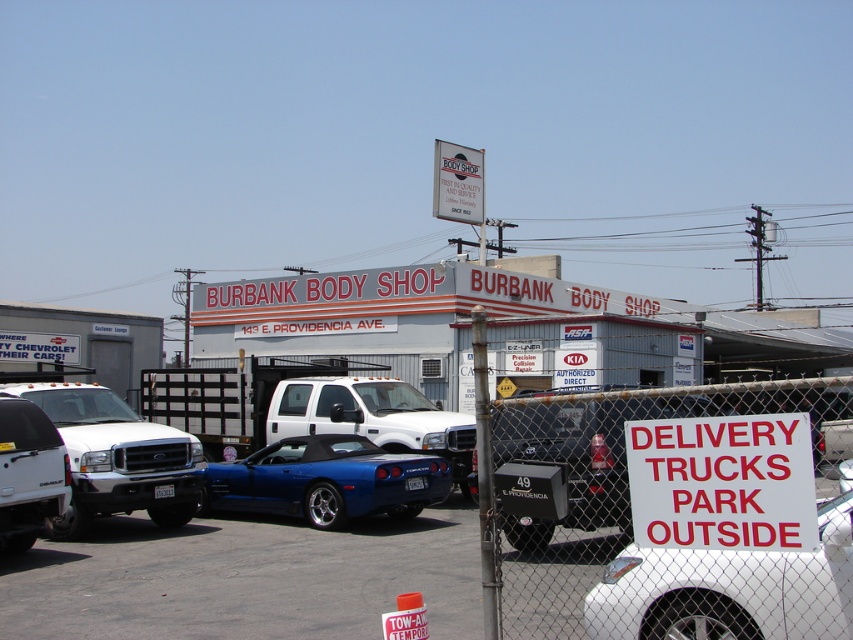
Question: Does white plastic sign at lower right have a larger size compared to matte white truck at left?

Choices:
 (A) no
 (B) yes

Answer: (A)

Question: Is white glossy truck at left bigger than white plastic sign at lower right?

Choices:
 (A) no
 (B) yes

Answer: (A)

Question: Which object appears farthest from the camera in this image?

Choices:
 (A) white glossy truck at left
 (B) white plastic sign at upper center
 (C) white glossy car at lower right

Answer: (B)

Question: Which is nearer to the white glossy car at lower right?

Choices:
 (A) white plastic sign at lower right
 (B) glossy blue convertible at center
 (C) white glossy truck at left
 (D) white matte truck at left

Answer: (A)

Question: Is metal chain-link fence at lower right positioned before white glossy car at lower right?

Choices:
 (A) no
 (B) yes

Answer: (B)

Question: Estimate the real-world distances between objects in this image. Which object is closer to the white matte truck at left?

Choices:
 (A) white glossy car at lower right
 (B) white plastic sign at upper center

Answer: (A)